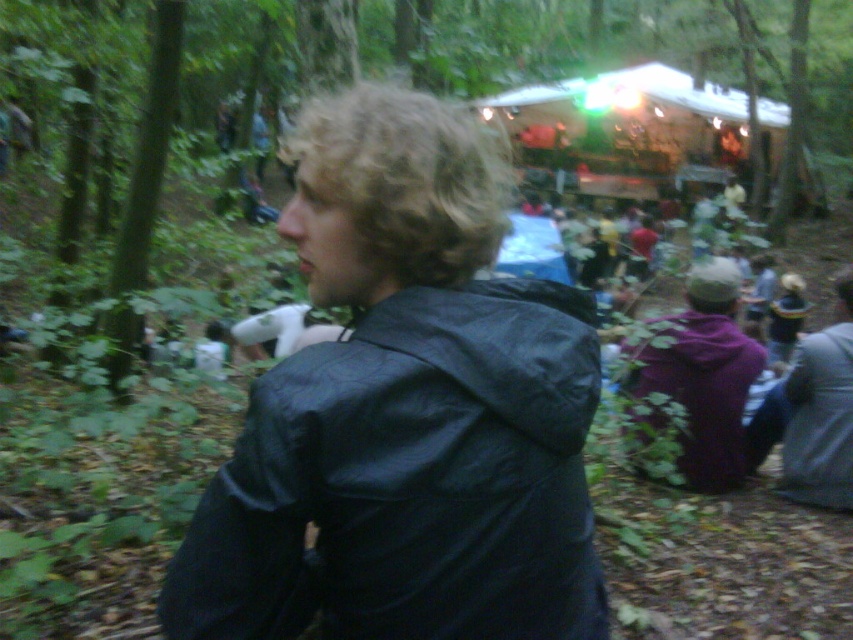
Question: Is purple fleece jacket at lower right to the right of shiny gold hat at center from the viewer's perspective?

Choices:
 (A) no
 (B) yes

Answer: (A)

Question: Which is farther from the black matte jacket at center?

Choices:
 (A) gray fabric jacket at lower right
 (B) curly blonde hair at upper left
 (C) purple fleece jacket at lower right
 (D) shiny gold hat at center

Answer: (D)

Question: Which object is the closest to the gray fabric jacket at lower right?

Choices:
 (A) shiny gold hat at center
 (B) curly blonde hair at upper left

Answer: (B)

Question: Is purple fleece jacket at lower right behind gray fabric jacket at lower right?

Choices:
 (A) yes
 (B) no

Answer: (B)

Question: Can you confirm if curly blonde hair at upper left is positioned to the left of shiny gold hat at center?

Choices:
 (A) yes
 (B) no

Answer: (A)

Question: Which point is farther from the camera taking this photo?

Choices:
 (A) (781, 483)
 (B) (683, 440)

Answer: (A)